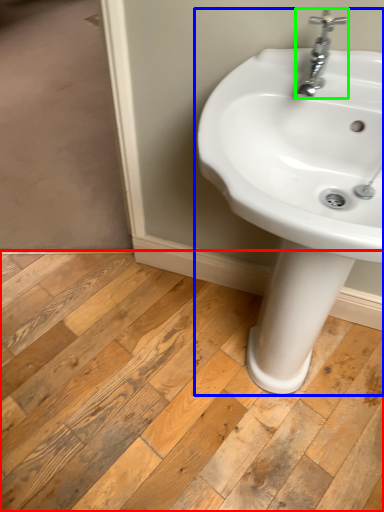
Question: Based on their relative distances, which object is farther from plank (highlighted by a red box)? Choose from sink (highlighted by a blue box) and tap (highlighted by a green box).

Choices:
 (A) sink
 (B) tap

Answer: (B)